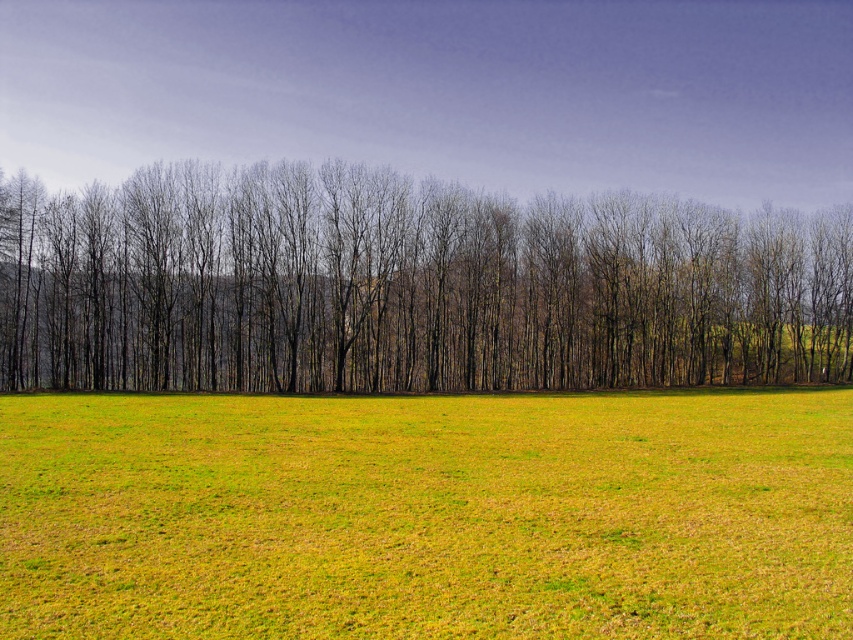
In the scene shown: You are standing in the middle of the grassy terrain and want to walk to both the point at coordinates point [426,544] and point [277,172]. Which point will require you to walk a shorter distance?

Point [426,544] is closer to the viewer than point [277,172], so walking to point [426,544] will require a shorter distance.